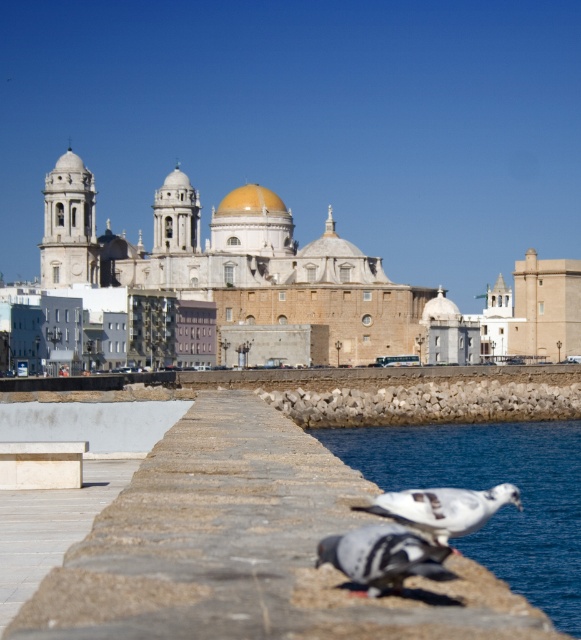
Is gray matte pigeon at lower center above white matte pigeon at lower center?

Yes.

Does point (356, 552) come behind point (486, 497)?

No, it is in front of (486, 497).

This screenshot has width=581, height=640. Identify the location of gray matte pigeon at lower center. (382, 556).

From the picture: Between blue water at lower right and gray matte pigeon at lower center, which one is positioned higher?

gray matte pigeon at lower center

Which is in front, point (535, 444) or point (381, 532)?

Point (381, 532)

Identify the location of blue water at lower right. (487, 486).

Does blue water at lower right come in front of white matte pigeon at lower center?

No.

Between point (496, 481) and point (415, 515), which one is positioned in front?

Point (415, 515)

This screenshot has height=640, width=581. Describe the element at coordinates (487, 486) in the screenshot. I see `blue water at lower right` at that location.

In order to click on blue water at lower right in this screenshot , I will do `click(487, 486)`.